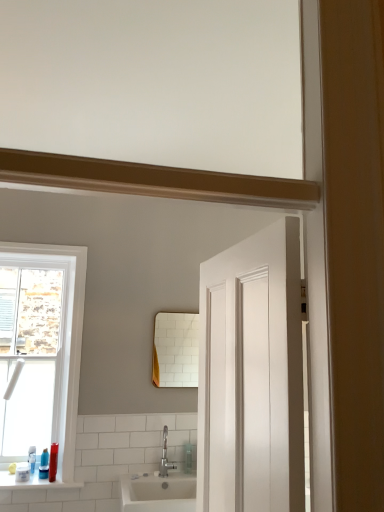
Question: Can you confirm if silver metallic faucet at lower center is thinner than white glossy window at left?

Choices:
 (A) no
 (B) yes

Answer: (A)

Question: Is the depth of silver metallic faucet at lower center less than that of white glossy window at left?

Choices:
 (A) yes
 (B) no

Answer: (B)

Question: Can we say silver metallic faucet at lower center lies outside white glossy window at left?

Choices:
 (A) yes
 (B) no

Answer: (A)

Question: Is silver metallic faucet at lower center behind white glossy window at left?

Choices:
 (A) no
 (B) yes

Answer: (B)

Question: From the image's perspective, is silver metallic faucet at lower center on white glossy window at left?

Choices:
 (A) yes
 (B) no

Answer: (B)

Question: Is silver metallic faucet at lower center shorter than white glossy window at left?

Choices:
 (A) no
 (B) yes

Answer: (B)

Question: Would you say white glossy window at left is a long distance from silver metallic faucet at lower center?

Choices:
 (A) no
 (B) yes

Answer: (A)

Question: From a real-world perspective, is white glossy window at left physically above silver metallic faucet at lower center?

Choices:
 (A) yes
 (B) no

Answer: (A)

Question: From the image's perspective, is white glossy window at left below silver metallic faucet at lower center?

Choices:
 (A) yes
 (B) no

Answer: (B)

Question: Is white glossy window at left shorter than silver metallic faucet at lower center?

Choices:
 (A) no
 (B) yes

Answer: (A)

Question: Is white glossy window at left bigger than silver metallic faucet at lower center?

Choices:
 (A) yes
 (B) no

Answer: (A)

Question: Is white glossy window at left not inside silver metallic faucet at lower center?

Choices:
 (A) yes
 (B) no

Answer: (A)

Question: From a real-world perspective, is white glossy window sill at lower left physically below clear plastic soap dispenser at center?

Choices:
 (A) yes
 (B) no

Answer: (A)